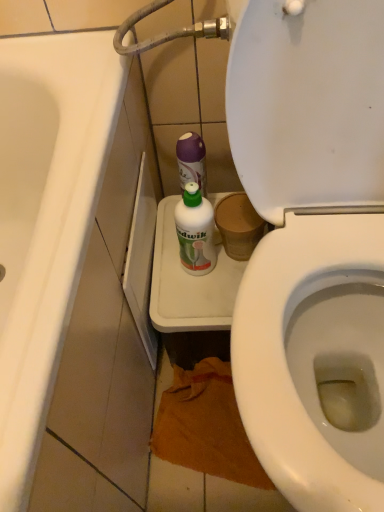
At what (x,y) coordinates should I click in order to perform the action: click on free space in front of white plastic bottle at center. Please return your answer as a coordinate pair (x, y). Image resolution: width=384 pixels, height=512 pixels. Looking at the image, I should click on (198, 305).